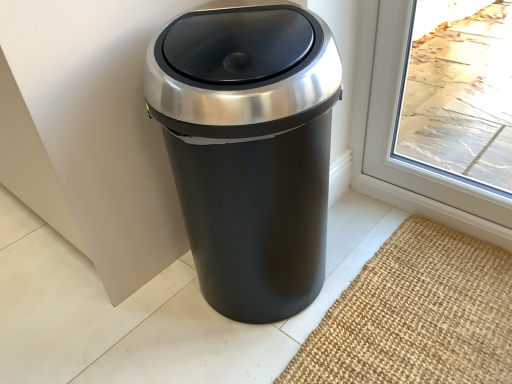
I want to click on free space to the left of matte black trash can at center, so click(137, 317).